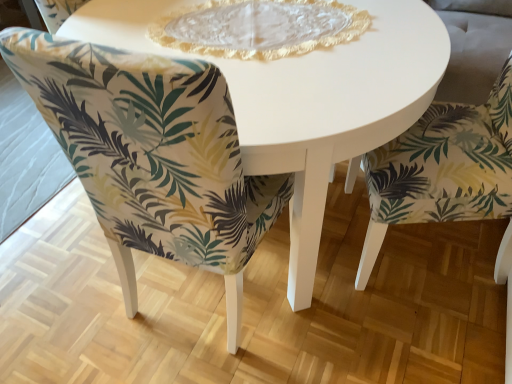
At what (x,y) coordinates should I click in order to perform the action: click on green leaf-patterned fabric chair at lower right, which ranks as the first chair in right-to-left order. Please return your answer as a coordinate pair (x, y). Image resolution: width=512 pixels, height=384 pixels. Looking at the image, I should click on click(443, 169).

The width and height of the screenshot is (512, 384). Describe the element at coordinates (152, 151) in the screenshot. I see `green leaf-patterned fabric chair at center, which is counted as the second chair, starting from the right` at that location.

The image size is (512, 384). I want to click on green leaf-patterned fabric chair at lower right, which ranks as the first chair in right-to-left order, so click(x=443, y=169).

From the image's perspective, is green leaf-patterned fabric chair at lower right, the second chair positioned from the left, over green leaf-patterned fabric chair at center, marked as the 1th chair in a left-to-right arrangement?

Yes, from the image's perspective, green leaf-patterned fabric chair at lower right, the second chair positioned from the left, is over green leaf-patterned fabric chair at center, marked as the 1th chair in a left-to-right arrangement.

Relative to green leaf-patterned fabric chair at center, which is counted as the second chair, starting from the right, is green leaf-patterned fabric chair at lower right, which ranks as the first chair in right-to-left order, in front or behind?

In the image, green leaf-patterned fabric chair at lower right, which ranks as the first chair in right-to-left order, appears behind green leaf-patterned fabric chair at center, which is counted as the second chair, starting from the right.

Based on the photo, between green leaf-patterned fabric chair at lower right, the second chair positioned from the left, and green leaf-patterned fabric chair at center, which is counted as the second chair, starting from the right, which one has less height?

Standing shorter between the two is green leaf-patterned fabric chair at center, which is counted as the second chair, starting from the right.

From a real-world perspective, relative to green leaf-patterned fabric chair at center, which is counted as the second chair, starting from the right, is green leaf-patterned fabric chair at lower right, which ranks as the first chair in right-to-left order, vertically above or below?

In terms of real-world spatial position, green leaf-patterned fabric chair at lower right, which ranks as the first chair in right-to-left order, is above green leaf-patterned fabric chair at center, which is counted as the second chair, starting from the right.

I want to click on chair that is the 1st object located below the white glossy table at center (from the image's perspective), so click(x=443, y=169).

Can you confirm if white glossy table at center is positioned to the right of green leaf-patterned fabric chair at lower right, the second chair positioned from the left?

Incorrect, white glossy table at center is not on the right side of green leaf-patterned fabric chair at lower right, the second chair positioned from the left.

Is white glossy table at center not near green leaf-patterned fabric chair at lower right, which ranks as the first chair in right-to-left order?

white glossy table at center is actually quite close to green leaf-patterned fabric chair at lower right, which ranks as the first chair in right-to-left order.

Is green leaf-patterned fabric chair at center, marked as the 1th chair in a left-to-right arrangement, bigger or smaller than white glossy table at center?

Clearly, green leaf-patterned fabric chair at center, marked as the 1th chair in a left-to-right arrangement, is smaller in size than white glossy table at center.

Which is less distant, [272,207] or [339,89]?

Positioned in front is point [339,89].

Based on the photo, is green leaf-patterned fabric chair at center, marked as the 1th chair in a left-to-right arrangement, not inside white glossy table at center?

A: No, most part of green leaf-patterned fabric chair at center, marked as the 1th chair in a left-to-right arrangement, lies within white glossy table at center.

From a real-world perspective, who is located lower, green leaf-patterned fabric chair at center, marked as the 1th chair in a left-to-right arrangement, or white glossy table at center?

white glossy table at center.

Does white glossy table at center appear on the right side of green leaf-patterned fabric chair at center, marked as the 1th chair in a left-to-right arrangement?

Yes, white glossy table at center is to the right of green leaf-patterned fabric chair at center, marked as the 1th chair in a left-to-right arrangement.

Which object is closer to the camera, white glossy table at center or green leaf-patterned fabric chair at center, marked as the 1th chair in a left-to-right arrangement?

green leaf-patterned fabric chair at center, marked as the 1th chair in a left-to-right arrangement, is in front.

Does point (352, 151) appear closer or farther from the camera than point (240, 282)?

Clearly, point (352, 151) is closer to the camera than point (240, 282).

Could you tell me if white glossy table at center is turned towards green leaf-patterned fabric chair at center, which is counted as the second chair, starting from the right?

No, white glossy table at center does not turn towards green leaf-patterned fabric chair at center, which is counted as the second chair, starting from the right.

Considering the points (86, 169) and (384, 181), which point is behind, point (86, 169) or point (384, 181)?

Positioned behind is point (384, 181).

Is the depth of green leaf-patterned fabric chair at center, which is counted as the second chair, starting from the right, less than that of green leaf-patterned fabric chair at lower right, the second chair positioned from the left?

Yes, it is in front of green leaf-patterned fabric chair at lower right, the second chair positioned from the left.

Between green leaf-patterned fabric chair at center, marked as the 1th chair in a left-to-right arrangement, and green leaf-patterned fabric chair at lower right, which ranks as the first chair in right-to-left order, which one has larger size?

Bigger between the two is green leaf-patterned fabric chair at center, marked as the 1th chair in a left-to-right arrangement.

Which of these two, green leaf-patterned fabric chair at center, marked as the 1th chair in a left-to-right arrangement, or green leaf-patterned fabric chair at lower right, which ranks as the first chair in right-to-left order, stands taller?

green leaf-patterned fabric chair at lower right, which ranks as the first chair in right-to-left order, is taller.

Which is closer to the camera, (477, 122) or (336, 119)?

Point (477, 122).

Does green leaf-patterned fabric chair at lower right, the second chair positioned from the left, have a lesser width compared to white glossy table at center?

Correct, the width of green leaf-patterned fabric chair at lower right, the second chair positioned from the left, is less than that of white glossy table at center.

Which of these two, green leaf-patterned fabric chair at lower right, which ranks as the first chair in right-to-left order, or white glossy table at center, stands shorter?

white glossy table at center.

Is the position of green leaf-patterned fabric chair at lower right, the second chair positioned from the left, more distant than that of white glossy table at center?

No, green leaf-patterned fabric chair at lower right, the second chair positioned from the left, is closer to the camera.

Find the location of a particular element. chair above the green leaf-patterned fabric chair at center, which is counted as the second chair, starting from the right (from the image's perspective) is located at coordinates (443, 169).

The height and width of the screenshot is (384, 512). I want to click on coffee table behind the green leaf-patterned fabric chair at lower right, the second chair positioned from the left, so click(x=306, y=101).

Considering their positions, is green leaf-patterned fabric chair at lower right, the second chair positioned from the left, positioned further to green leaf-patterned fabric chair at center, which is counted as the second chair, starting from the right, than white glossy table at center?

Based on the image, green leaf-patterned fabric chair at lower right, the second chair positioned from the left, appears to be further to green leaf-patterned fabric chair at center, which is counted as the second chair, starting from the right.

When comparing their distances from green leaf-patterned fabric chair at lower right, which ranks as the first chair in right-to-left order, does green leaf-patterned fabric chair at center, marked as the 1th chair in a left-to-right arrangement, or white glossy table at center seem closer?

Based on the image, white glossy table at center appears to be nearer to green leaf-patterned fabric chair at lower right, which ranks as the first chair in right-to-left order.

When comparing their distances from green leaf-patterned fabric chair at lower right, which ranks as the first chair in right-to-left order, does white glossy table at center or green leaf-patterned fabric chair at center, which is counted as the second chair, starting from the right, seem closer?

Among the two, white glossy table at center is located nearer to green leaf-patterned fabric chair at lower right, which ranks as the first chair in right-to-left order.

Estimate the real-world distances between objects in this image. Which object is further from white glossy table at center, green leaf-patterned fabric chair at lower right, which ranks as the first chair in right-to-left order, or green leaf-patterned fabric chair at center, marked as the 1th chair in a left-to-right arrangement?

Among the two, green leaf-patterned fabric chair at lower right, which ranks as the first chair in right-to-left order, is located further to white glossy table at center.

In the scene shown: Which object lies further to the anchor point green leaf-patterned fabric chair at center, which is counted as the second chair, starting from the right, white glossy table at center or green leaf-patterned fabric chair at lower right, the second chair positioned from the left?

green leaf-patterned fabric chair at lower right, the second chair positioned from the left, lies further to green leaf-patterned fabric chair at center, which is counted as the second chair, starting from the right, than the other object.

Based on the photo, estimate the real-world distances between objects in this image. Which object is closer to white glossy table at center, green leaf-patterned fabric chair at center, marked as the 1th chair in a left-to-right arrangement, or green leaf-patterned fabric chair at lower right, the second chair positioned from the left?

The object closer to white glossy table at center is green leaf-patterned fabric chair at center, marked as the 1th chair in a left-to-right arrangement.

At what (x,y) coordinates should I click in order to perform the action: click on coffee table between green leaf-patterned fabric chair at center, marked as the 1th chair in a left-to-right arrangement, and green leaf-patterned fabric chair at lower right, which ranks as the first chair in right-to-left order, in the horizontal direction. Please return your answer as a coordinate pair (x, y). Looking at the image, I should click on (306, 101).